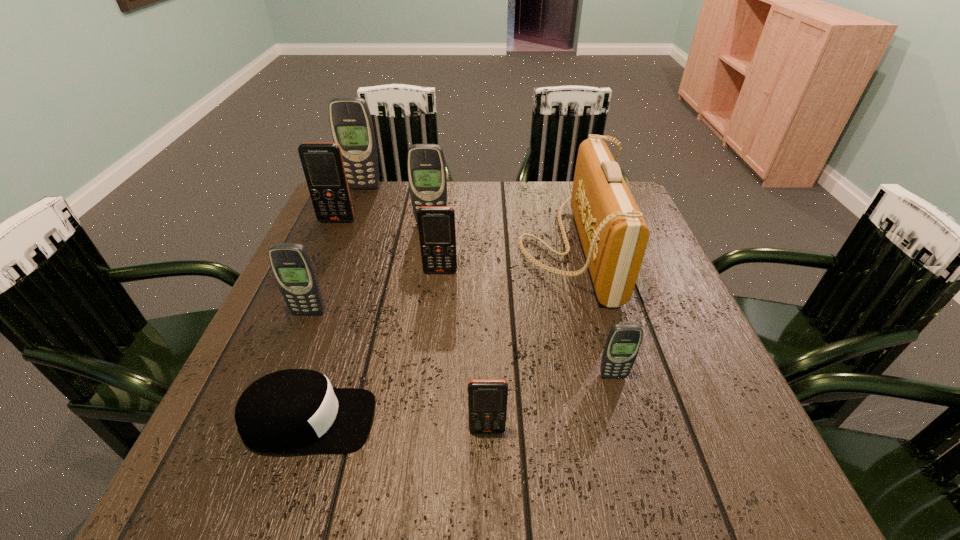
Image resolution: width=960 pixels, height=540 pixels. Find the location of `the biggest gray cellular telephone`. the biggest gray cellular telephone is located at coordinates (351, 124).

Identify the location of the farthest gray cellular telephone. Image resolution: width=960 pixels, height=540 pixels. (351, 124).

Identify the location of handbag. The width and height of the screenshot is (960, 540). (614, 235).

Locate an element on the screen. the farthest orange cellular telephone is located at coordinates (322, 163).

The width and height of the screenshot is (960, 540). I want to click on the biggest orange cellular telephone, so click(x=322, y=163).

Identify the location of the third gray cellular telephone from left to right. (426, 167).

Image resolution: width=960 pixels, height=540 pixels. In order to click on the third smallest gray cellular telephone in this screenshot , I will do `click(426, 167)`.

The image size is (960, 540). I want to click on the third biggest gray cellular telephone, so click(x=291, y=264).

Where is `the third farthest gray cellular telephone`? The image size is (960, 540). the third farthest gray cellular telephone is located at coordinates (291, 264).

The width and height of the screenshot is (960, 540). I want to click on the fourth nearest cellular telephone, so click(437, 233).